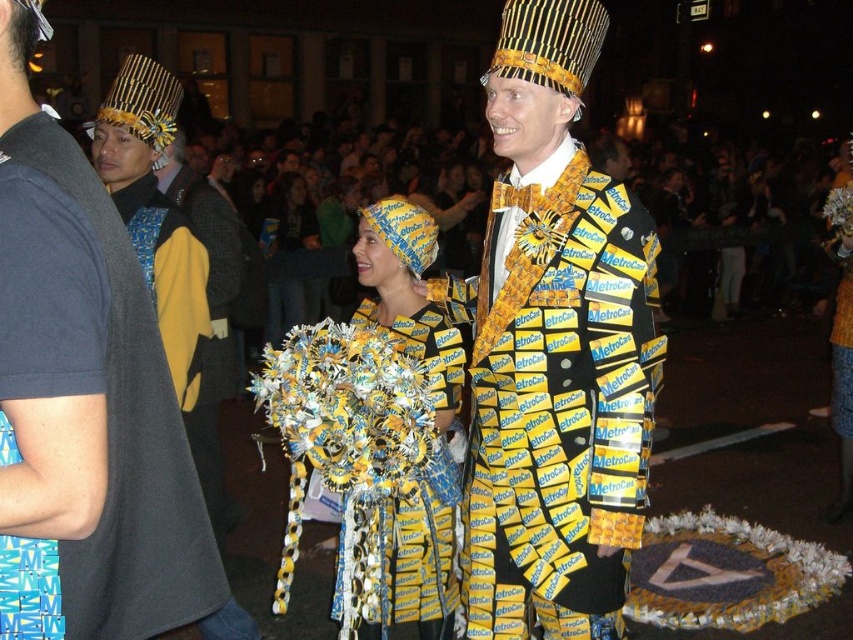
Question: Does yellow paper suit at center have a larger size compared to yellow paper dress at center?

Choices:
 (A) yes
 (B) no

Answer: (A)

Question: Is yellow paper suit at center above yellow paper bag at center?

Choices:
 (A) yes
 (B) no

Answer: (B)

Question: Which point appears closest to the camera in this image?

Choices:
 (A) (592, 413)
 (B) (273, 268)
 (C) (300, 260)
 (D) (451, 369)

Answer: (A)

Question: Where is yellow paper suit at center located in relation to yellow paper bag at center in the image?

Choices:
 (A) right
 (B) left

Answer: (A)

Question: Based on their relative distances, which object is farther from the yellow paper bag at center?

Choices:
 (A) yellow paper dress at center
 (B) yellow paper at center
 (C) yellow/yellow paper costume at center

Answer: (C)

Question: Which point appears farthest from the camera in this image?

Choices:
 (A) (238, 131)
 (B) (274, 285)
 (C) (0, 109)
 (D) (538, 456)

Answer: (A)